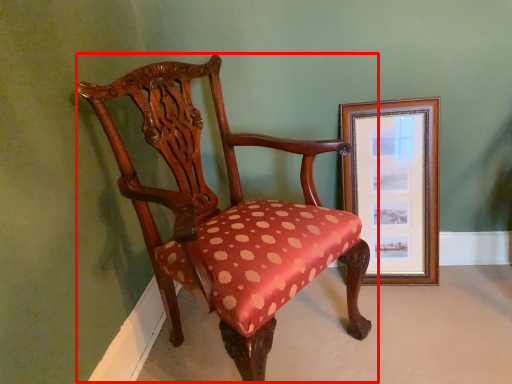
Question: Where is chair (annotated by the red box) located in relation to picture frame in the image?

Choices:
 (A) left
 (B) right

Answer: (A)